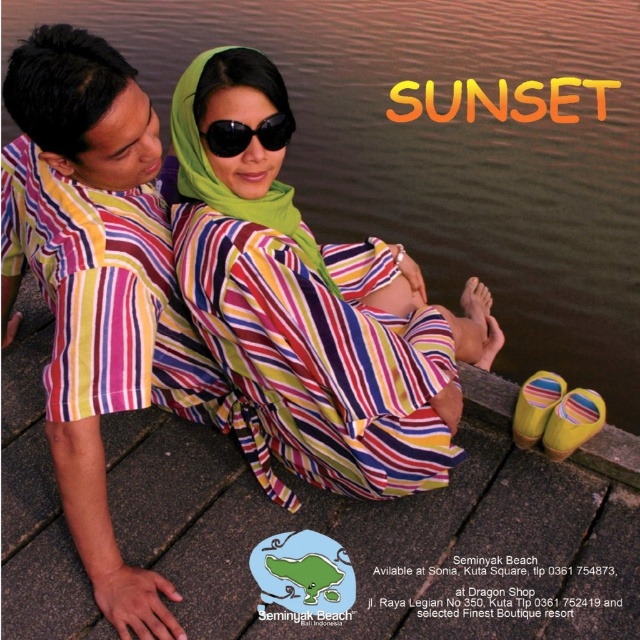
Question: Which object is farther from the camera taking this photo?

Choices:
 (A) striped cotton shirt at left
 (B) matte striped dress at center
 (C) black matte sunglasses at center

Answer: (C)

Question: Which of these objects is positioned farthest from the smooth brown water at center?

Choices:
 (A) black matte sunglasses at center
 (B) matte striped baby at center
 (C) striped cotton shirt at left

Answer: (A)

Question: Is smooth brown water at center to the left of matte striped baby at center from the viewer's perspective?

Choices:
 (A) no
 (B) yes

Answer: (A)

Question: Which point is closer to the camera?

Choices:
 (A) (358, 275)
 (B) (333, 368)

Answer: (B)

Question: Is smooth brown water at center above matte striped baby at center?

Choices:
 (A) yes
 (B) no

Answer: (A)

Question: Is smooth brown water at center closer to camera compared to black matte sunglasses at center?

Choices:
 (A) no
 (B) yes

Answer: (A)